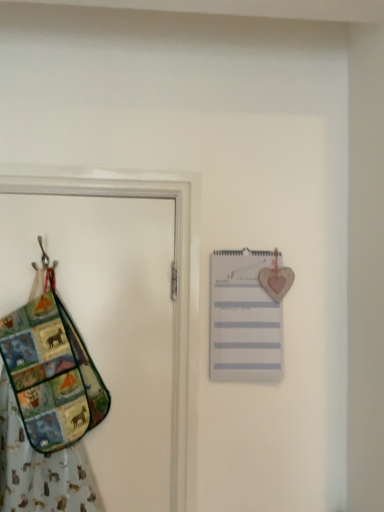
Question: From their relative heights in the image, would you say white paper list at upper right is taller or shorter than multicolored fabric door at left?

Choices:
 (A) tall
 (B) short

Answer: (B)

Question: In the image, is white paper list at upper right on the left side or the right side of multicolored fabric door at left?

Choices:
 (A) right
 (B) left

Answer: (A)

Question: Considering the real-world distances, which object is closest to the multicolored fabric handbag at left?

Choices:
 (A) multicolored fabric door at left
 (B) white paper list at upper right

Answer: (A)

Question: Estimate the real-world distances between objects in this image. Which object is closer to the white paper list at upper right?

Choices:
 (A) multicolored fabric door at left
 (B) multicolored fabric handbag at left

Answer: (A)